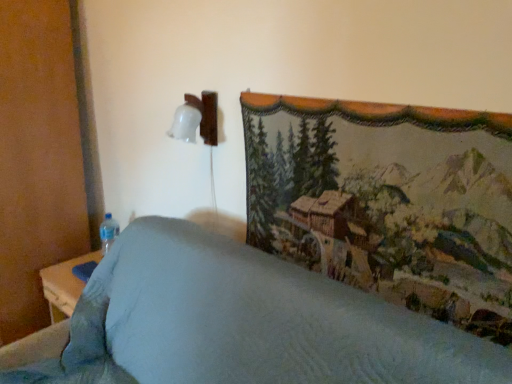
Question: Is transparent plastic bottle at lower left wider than textured tapestry at upper right?

Choices:
 (A) yes
 (B) no

Answer: (A)

Question: Can you confirm if transparent plastic bottle at lower left is bigger than textured tapestry at upper right?

Choices:
 (A) no
 (B) yes

Answer: (A)

Question: From the image's perspective, is transparent plastic bottle at lower left under textured tapestry at upper right?

Choices:
 (A) yes
 (B) no

Answer: (A)

Question: From a real-world perspective, is transparent plastic bottle at lower left over textured tapestry at upper right?

Choices:
 (A) no
 (B) yes

Answer: (A)

Question: Is transparent plastic bottle at lower left closer to camera compared to textured tapestry at upper right?

Choices:
 (A) yes
 (B) no

Answer: (B)

Question: Is point (111, 241) positioned closer to the camera than point (192, 278)?

Choices:
 (A) closer
 (B) farther

Answer: (B)

Question: From the image's perspective, is transparent plastic bottle at lower left positioned above or below textured fabric bedspread at center?

Choices:
 (A) above
 (B) below

Answer: (A)

Question: Considering the positions of transparent plastic bottle at lower left and textured fabric bedspread at center in the image, is transparent plastic bottle at lower left bigger or smaller than textured fabric bedspread at center?

Choices:
 (A) big
 (B) small

Answer: (B)

Question: From their relative heights in the image, would you say transparent plastic bottle at lower left is taller or shorter than textured fabric bedspread at center?

Choices:
 (A) short
 (B) tall

Answer: (A)

Question: In the image, is transparent plastic bottle at lower left positioned in front of or behind textured tapestry at upper right?

Choices:
 (A) front
 (B) behind

Answer: (B)

Question: Choose the correct answer: Is transparent plastic bottle at lower left inside textured tapestry at upper right or outside it?

Choices:
 (A) inside
 (B) outside

Answer: (B)

Question: Considering the positions of transparent plastic bottle at lower left and textured tapestry at upper right in the image, is transparent plastic bottle at lower left taller or shorter than textured tapestry at upper right?

Choices:
 (A) tall
 (B) short

Answer: (B)

Question: From the image's perspective, is transparent plastic bottle at lower left above or below textured tapestry at upper right?

Choices:
 (A) below
 (B) above

Answer: (A)

Question: In terms of height, does textured fabric bedspread at center look taller or shorter compared to textured tapestry at upper right?

Choices:
 (A) short
 (B) tall

Answer: (B)

Question: Is textured fabric bedspread at center wider or thinner than textured tapestry at upper right?

Choices:
 (A) thin
 (B) wide

Answer: (B)